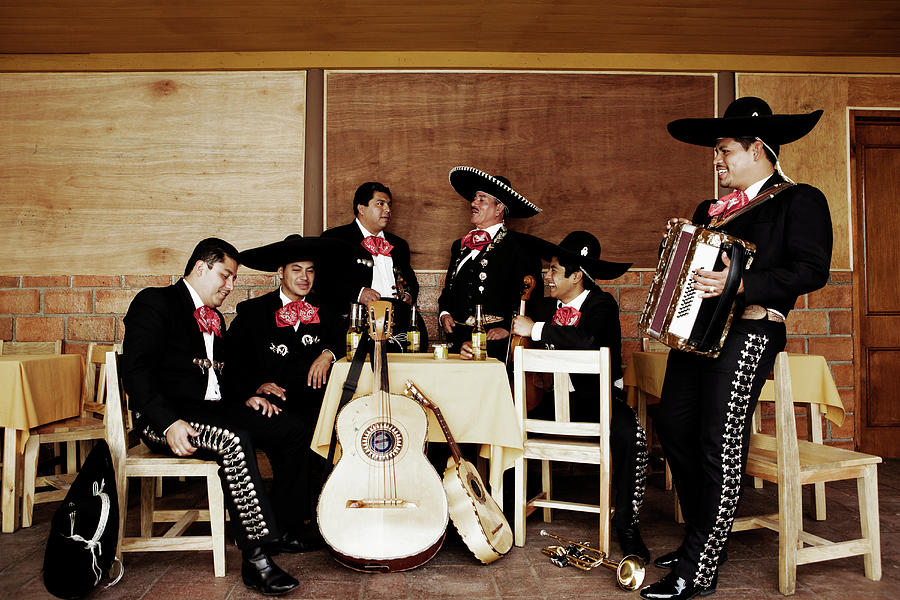
The height and width of the screenshot is (600, 900). What are the coordinates of `cups` in the screenshot? It's located at (453, 350).